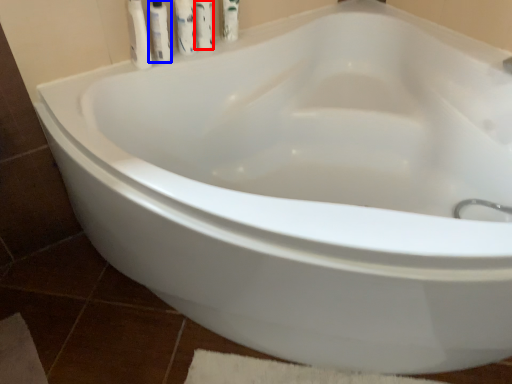
Question: Which point is further to the camera, cleaning product (highlighted by a red box) or toiletry (highlighted by a blue box)?

Choices:
 (A) cleaning product
 (B) toiletry

Answer: (A)